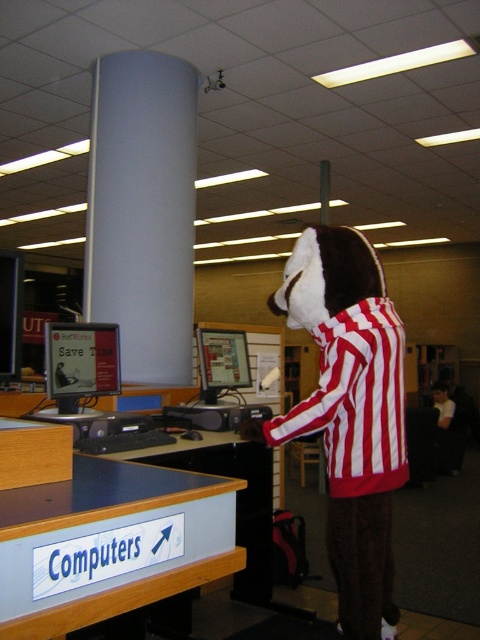
Based on the photo, you are a visitor in the library and you see the blue laminate sign at lower left and the white smooth pillar at center. Which object is narrower?

The blue laminate sign at lower left has a lesser width compared to the white smooth pillar at center, so the blue laminate sign at lower left is narrower.

From the picture: You are standing in the library and want to reach the point marked at coordinates point (44, 563). If your arm reaches 1 meter, can you touch that point without moving your feet?

The distance between you and point (44, 563) is 1.12 meters, which is beyond your 1 meter arm reach. You cannot touch it without moving your feet.

You are a visitor in the library and want to use the computers. You see the white smooth pillar at center and the matte black monitor at center. Which object is larger?

The white smooth pillar at center is bigger than the matte black monitor at center.